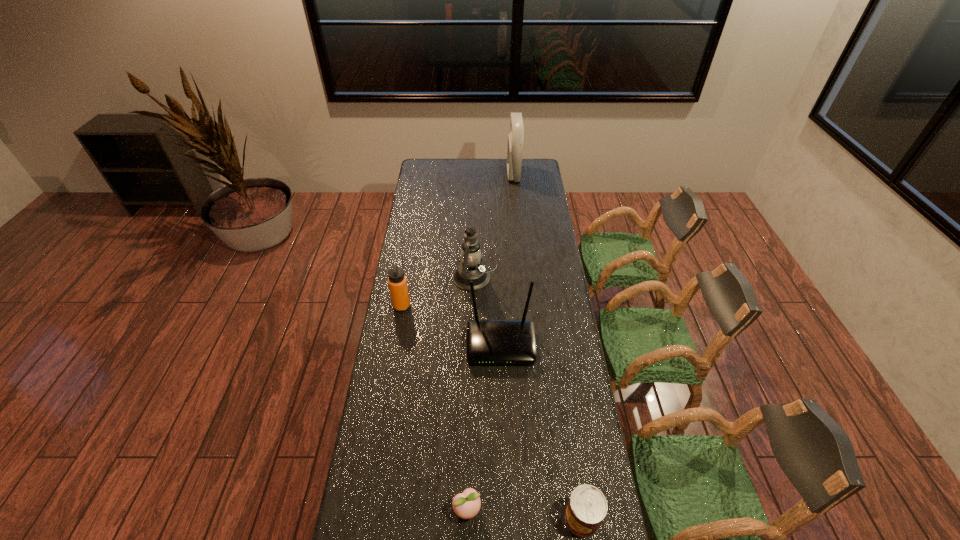
Identify the location of free space located on the front-facing side of the first-aid kit. (458, 174).

The image size is (960, 540). Find the location of `vacant space situated on the front of the fifth nearest object`. vacant space situated on the front of the fifth nearest object is located at coordinates (473, 362).

Where is `free space located 0.330m on the front-facing side of the fourth farthest object`? The image size is (960, 540). free space located 0.330m on the front-facing side of the fourth farthest object is located at coordinates (505, 452).

In order to click on vacant position located on the front of the fourth nearest object in this screenshot , I will do `click(396, 341)`.

Identify the location of vacant space located on the left of the fifth tallest object. Image resolution: width=960 pixels, height=540 pixels. (547, 518).

Identify the location of vacant space situated 0.220m on the left of the peach. point(380,509).

Where is `object situated at the far edge`? object situated at the far edge is located at coordinates [x=515, y=139].

Identify the location of object that is at the left edge. (397, 282).

You are a GUI agent. You are given a task and a screenshot of the screen. Output one action in this format:
    pyautogui.click(x=<x>, y=<y>)
    Task: Click on the first-aid kit that is at the right edge
    
    Given the screenshot: What is the action you would take?
    pyautogui.click(x=515, y=139)

This screenshot has height=540, width=960. I want to click on can situated at the right edge, so click(x=587, y=507).